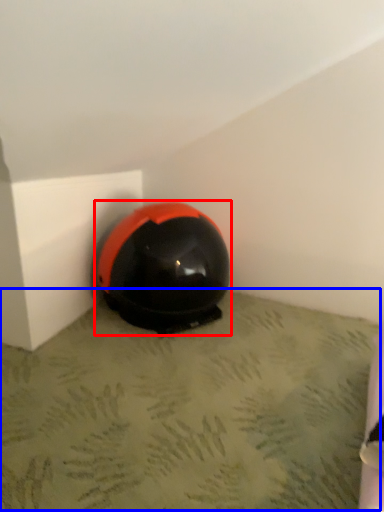
Question: Which of the following is the closest to the observer, helmet (highlighted by a red box) or concrete (highlighted by a blue box)?

Choices:
 (A) helmet
 (B) concrete

Answer: (B)